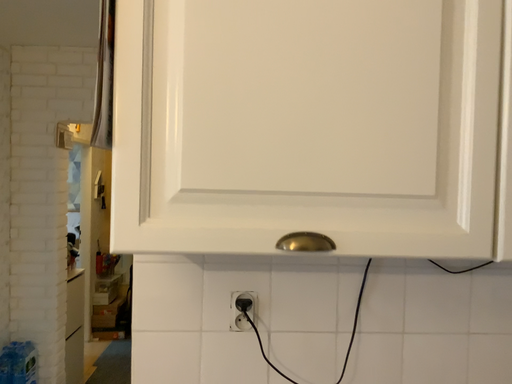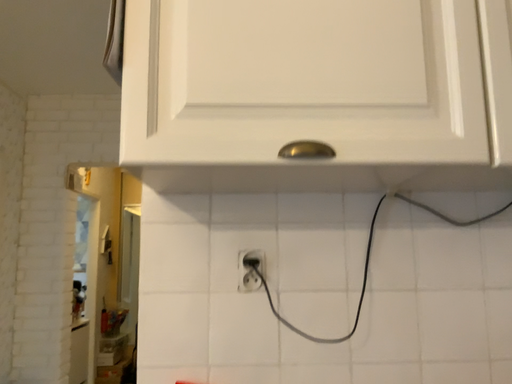
Question: Which way did the camera rotate in the video?

Choices:
 (A) rotated downward
 (B) rotated upward

Answer: (B)